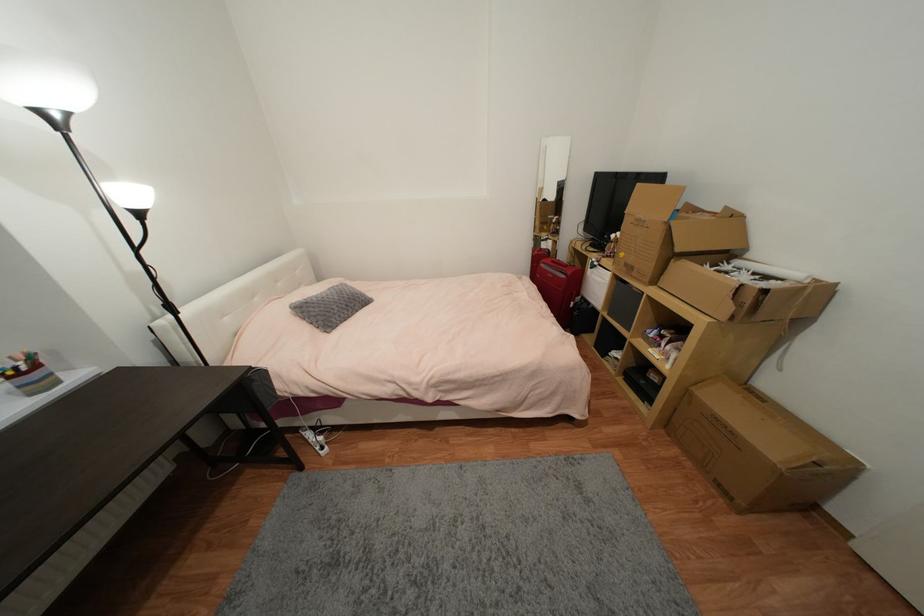
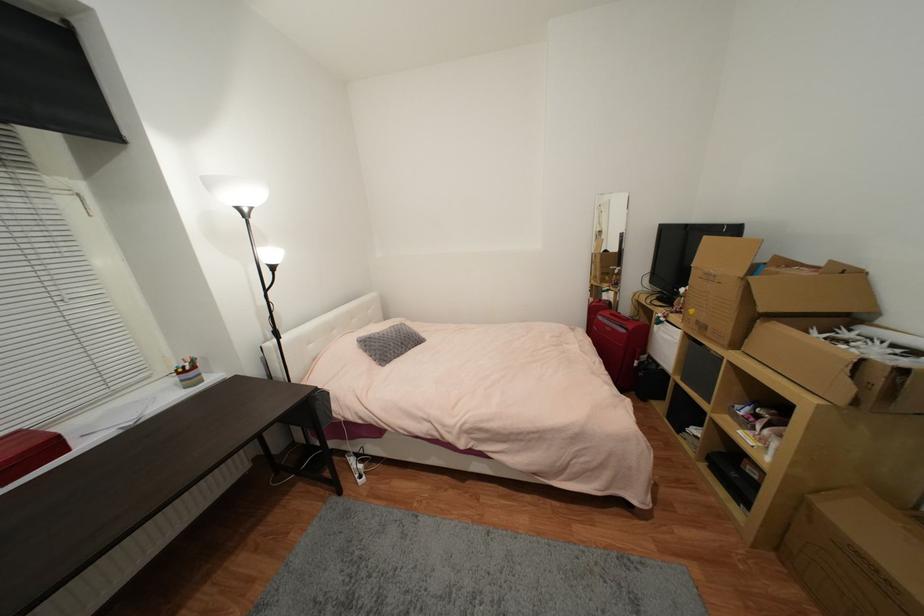
Where in the second image is the point corresponding to (x=179, y=314) from the first image?

(283, 339)